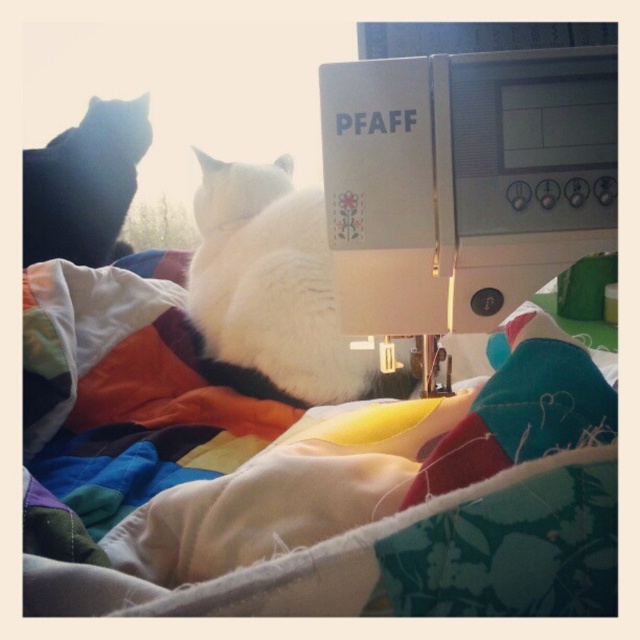
Can you confirm if multicolored quilt at center is thinner than white plastic sewing machine at upper right?

Incorrect, multicolored quilt at center's width is not less than white plastic sewing machine at upper right's.

Does multicolored quilt at center have a greater height compared to white plastic sewing machine at upper right?

Yes.

In order to click on multicolored quilt at center in this screenshot , I will do `click(308, 477)`.

Consider the image. Is white plastic sewing machine at upper right above white fluffy cat at center?

Yes, white plastic sewing machine at upper right is above white fluffy cat at center.

At what (x,y) coordinates should I click in order to perform the action: click on white plastic sewing machine at upper right. Please return your answer as a coordinate pair (x, y). Looking at the image, I should click on (465, 180).

Which is in front, point (611, 97) or point (320, 378)?

Point (611, 97)

Find the location of a particular element. Image resolution: width=640 pixels, height=640 pixels. white plastic sewing machine at upper right is located at coordinates 465,180.

Who is more forward, (291, 225) or (49, 248)?

Point (291, 225)

Is white fluffy cat at center below black fur cat at left?

Yes.

The width and height of the screenshot is (640, 640). What do you see at coordinates (275, 285) in the screenshot?
I see `white fluffy cat at center` at bounding box center [275, 285].

Identify the location of white fluffy cat at center. The width and height of the screenshot is (640, 640). (275, 285).